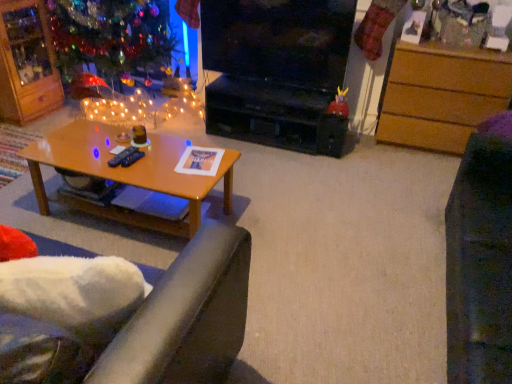
This screenshot has height=384, width=512. Identify the location of free space that is to the left of satin blue remote control at center, which is counted as the second remote control, starting from the right. (88, 152).